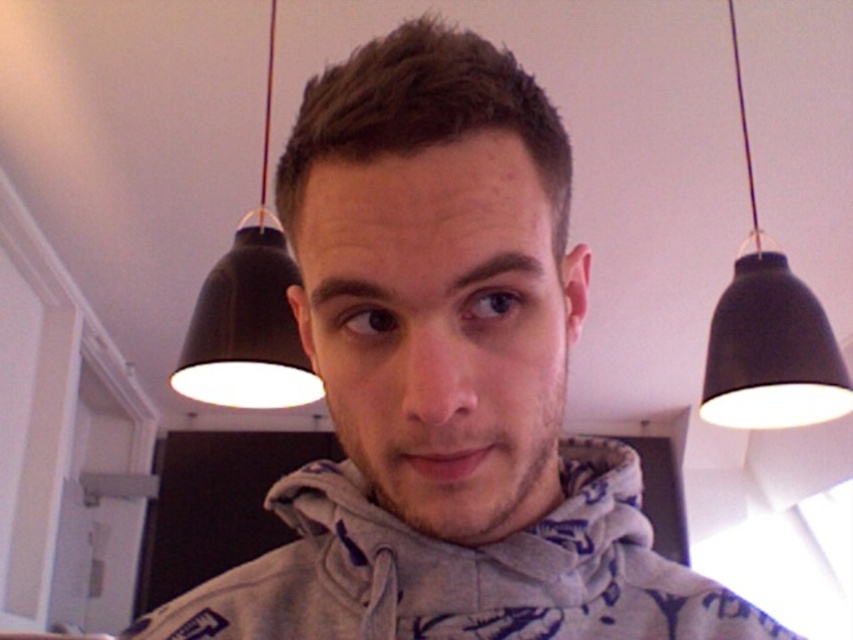
Question: Which of the following is the farthest from the observer?

Choices:
 (A) (251, 348)
 (B) (805, 336)

Answer: (B)

Question: Does black matte lampshade at upper center have a larger size compared to black matte lampshade at upper left?

Choices:
 (A) no
 (B) yes

Answer: (B)

Question: Which object is farther from the camera taking this photo?

Choices:
 (A) black matte lampshade at upper left
 (B) black matte lampshade at upper center

Answer: (B)

Question: Can you confirm if black matte lampshade at upper center is positioned to the left of black matte lampshade at upper left?

Choices:
 (A) no
 (B) yes

Answer: (A)

Question: Which point is farther to the camera?

Choices:
 (A) black matte lampshade at upper left
 (B) black matte lampshade at upper center

Answer: (B)

Question: Is black matte lampshade at upper center further to the viewer compared to black matte lampshade at upper left?

Choices:
 (A) no
 (B) yes

Answer: (B)